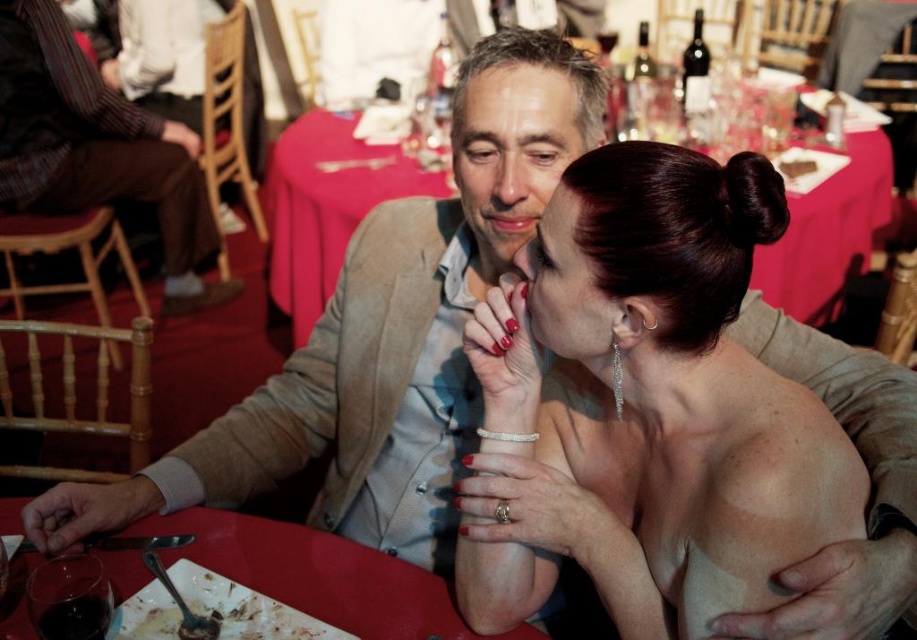
You are a photographer trying to capture a closeup shot of the shiny silver earrings at center and the smooth red tablecloth at center. Which object would you need to focus on first if you want to ensure both are in focus, considering their sizes?

The shiny silver earrings at center is thinner than the smooth red tablecloth at center, so you should focus on the shiny silver earrings at center first since smaller objects require precise focus to capture details.

You are a photographer trying to capture a closeup of the shiny silver earrings at center and the smooth red table at center. Which object should you focus on first if you want to ensure both are in focus without moving the camera?

The shiny silver earrings at center is closer to the viewer than the smooth red table at center, so focus on the shiny silver earrings at center first to ensure both are in focus.